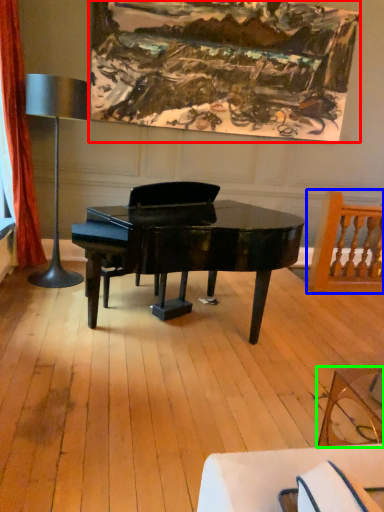
Question: Considering the real-world distances, which object is closest to picture frame (highlighted by a red box)? chair (highlighted by a blue box) or coffee table (highlighted by a green box).

Choices:
 (A) chair
 (B) coffee table

Answer: (A)